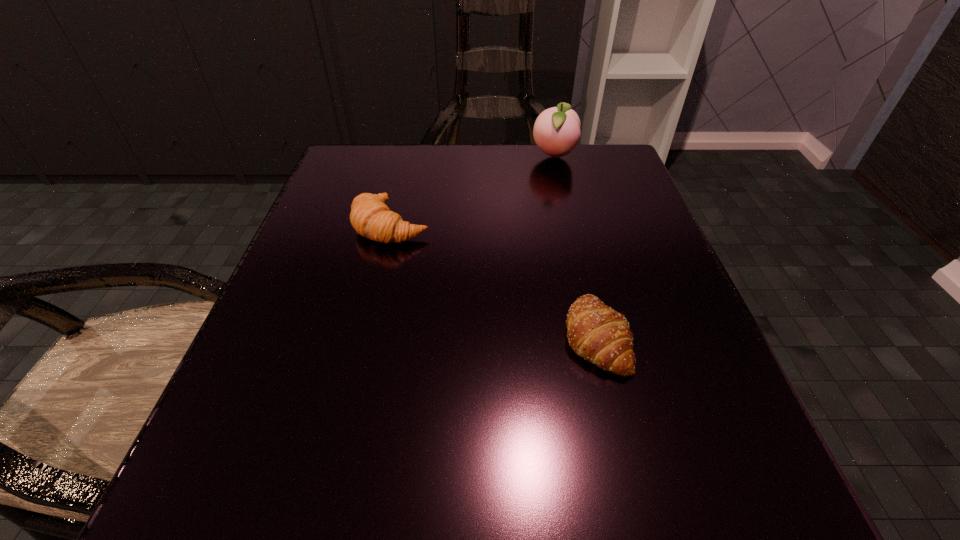
At what (x,y) coordinates should I click in order to perform the action: click on free spot between the right crescent roll and the second nearest object. Please return your answer as a coordinate pair (x, y). The width and height of the screenshot is (960, 540). Looking at the image, I should click on (493, 281).

Locate an element on the screen. The height and width of the screenshot is (540, 960). object that stands as the closest to the second farthest object is located at coordinates (556, 131).

The height and width of the screenshot is (540, 960). I want to click on object identified as the second closest to the nearest object, so click(x=556, y=131).

Image resolution: width=960 pixels, height=540 pixels. I want to click on vacant area that satisfies the following two spatial constraints: 1. on the back side of the left crescent roll; 2. on the left side of the farthest object, so click(x=407, y=157).

The height and width of the screenshot is (540, 960). In order to click on free space that satisfies the following two spatial constraints: 1. on the front side of the nearer crescent roll; 2. on the left side of the second farthest object in this screenshot , I will do `click(365, 336)`.

You are a GUI agent. You are given a task and a screenshot of the screen. Output one action in this format:
    pyautogui.click(x=<x>, y=<y>)
    Task: Click on the free space that satisfies the following two spatial constraints: 1. on the back side of the nearest object; 2. on the right side of the farthest object
    
    Given the screenshot: What is the action you would take?
    pyautogui.click(x=553, y=157)

Locate an element on the screen. blank area in the image that satisfies the following two spatial constraints: 1. on the back side of the tallest object; 2. on the left side of the left crescent roll is located at coordinates (407, 157).